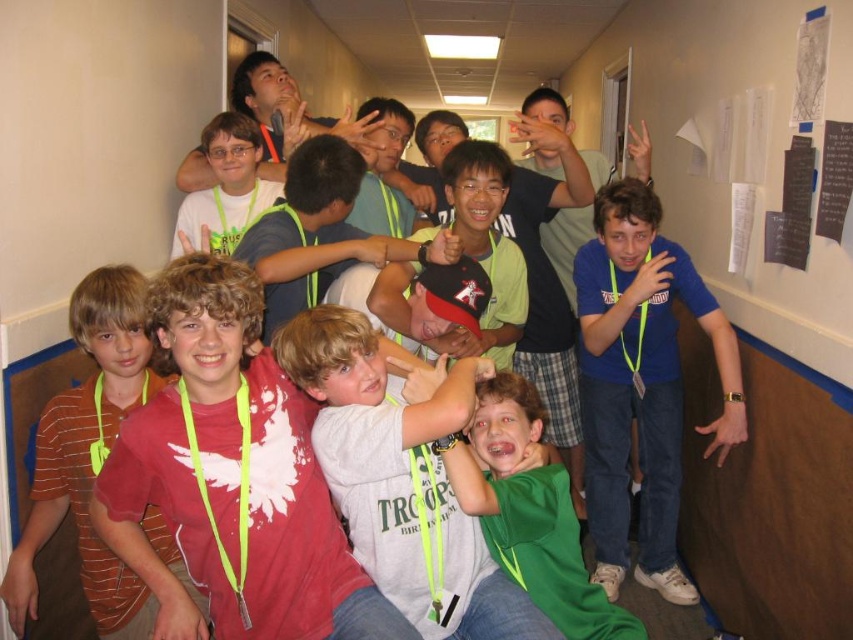
Question: Does white t-shirt at center have a greater width compared to matte green lanyard at center?

Choices:
 (A) yes
 (B) no

Answer: (A)

Question: Which is farther from the green matte shirt at center?

Choices:
 (A) blue t-shirt at right
 (B) matte red t-shirt at center

Answer: (A)

Question: Is white t-shirt at center to the left of green matte shirt at center from the viewer's perspective?

Choices:
 (A) no
 (B) yes

Answer: (B)

Question: Which point is closer to the camera?

Choices:
 (A) (378, 458)
 (B) (296, 422)
 (C) (643, 182)
 (D) (537, 596)

Answer: (A)

Question: Which point is closer to the camera?

Choices:
 (A) (666, 378)
 (B) (520, 552)

Answer: (B)

Question: Does white t-shirt at center have a smaller size compared to green matte shirt at center?

Choices:
 (A) no
 (B) yes

Answer: (A)